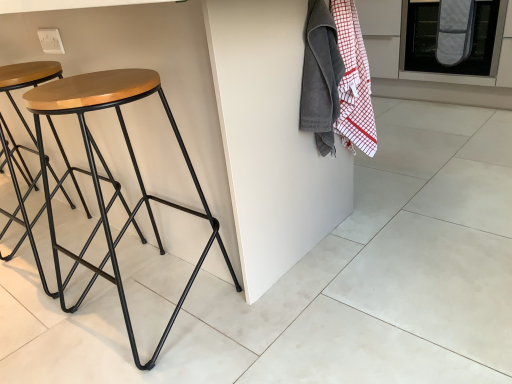
Question: Is gray quilted oven mitt at upper right looking in the opposite direction of velvet-like gray blanket at upper right?

Choices:
 (A) yes
 (B) no

Answer: (B)

Question: Is gray quilted oven mitt at upper right in front of velvet-like gray blanket at upper right?

Choices:
 (A) yes
 (B) no

Answer: (A)

Question: Is gray quilted oven mitt at upper right taller than velvet-like gray blanket at upper right?

Choices:
 (A) no
 (B) yes

Answer: (B)

Question: Is there a large distance between gray quilted oven mitt at upper right and velvet-like gray blanket at upper right?

Choices:
 (A) yes
 (B) no

Answer: (B)

Question: Is gray quilted oven mitt at upper right smaller than velvet-like gray blanket at upper right?

Choices:
 (A) yes
 (B) no

Answer: (B)

Question: Does gray quilted oven mitt at upper right appear on the right side of velvet-like gray blanket at upper right?

Choices:
 (A) yes
 (B) no

Answer: (A)

Question: Is woodenmaterial/texturestool at left positioned beyond the bounds of gray quilted oven mitt at upper right?

Choices:
 (A) no
 (B) yes

Answer: (B)

Question: Does woodenmaterial/texturestool at left lie behind gray quilted oven mitt at upper right?

Choices:
 (A) no
 (B) yes

Answer: (A)

Question: Is woodenmaterial/texturestool at left shorter than gray quilted oven mitt at upper right?

Choices:
 (A) no
 (B) yes

Answer: (A)

Question: Is woodenmaterial/texturestool at left oriented away from gray quilted oven mitt at upper right?

Choices:
 (A) no
 (B) yes

Answer: (A)

Question: Does woodenmaterial/texturestool at left have a smaller size compared to gray quilted oven mitt at upper right?

Choices:
 (A) yes
 (B) no

Answer: (A)

Question: Considering the relative positions of woodenmaterial/texturestool at left and gray quilted oven mitt at upper right in the image provided, is woodenmaterial/texturestool at left to the left of gray quilted oven mitt at upper right from the viewer's perspective?

Choices:
 (A) yes
 (B) no

Answer: (A)

Question: Is woodenmaterial/texturestool at left thinner than velvet-like gray blanket at upper right?

Choices:
 (A) yes
 (B) no

Answer: (B)